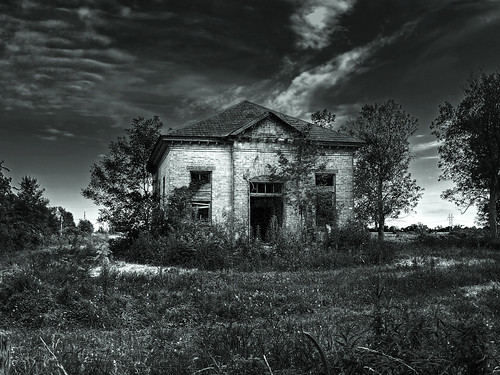
Locate an element on the screen. dark entrance is located at coordinates (267, 212).